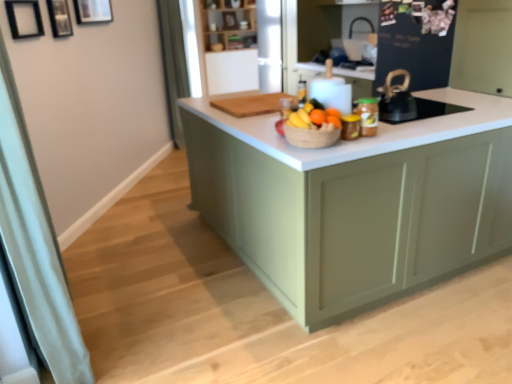
Question: Could you tell me if orange matte at center, which appears as the first orange when viewed from the right, is facing translucent glass bottle at center?

Choices:
 (A) no
 (B) yes

Answer: (A)

Question: From a real-world perspective, is orange matte at center, which appears as the first orange when viewed from the right, on translucent glass bottle at center?

Choices:
 (A) no
 (B) yes

Answer: (A)

Question: Is orange matte at center, marked as the 2th orange in a left-to-right arrangement, located outside translucent glass bottle at center?

Choices:
 (A) no
 (B) yes

Answer: (B)

Question: Is orange matte at center, which is counted as the first orange, starting from the back, at the left side of translucent glass bottle at center?

Choices:
 (A) yes
 (B) no

Answer: (B)

Question: From a real-world perspective, is orange matte at center, which appears as the first orange when viewed from the right, below translucent glass bottle at center?

Choices:
 (A) no
 (B) yes

Answer: (B)

Question: From the image's perspective, is orange matte at center, marked as the 2th orange in a left-to-right arrangement, below translucent glass bottle at center?

Choices:
 (A) no
 (B) yes

Answer: (B)

Question: Can we say wooden picture frame at upper left, arranged as the first picture frame when viewed from the back, lies outside orange matte at center, which appears as the first orange when viewed from the front?

Choices:
 (A) yes
 (B) no

Answer: (A)

Question: From a real-world perspective, does wooden picture frame at upper left, which appears as the 3th picture frame when viewed from the front, stand above orange matte at center, the 2th orange in the back-to-front sequence?

Choices:
 (A) yes
 (B) no

Answer: (A)

Question: Considering the relative sizes of wooden picture frame at upper left, which appears as the 3th picture frame when viewed from the front, and orange matte at center, the 2th orange in the back-to-front sequence, in the image provided, is wooden picture frame at upper left, which appears as the 3th picture frame when viewed from the front, thinner than orange matte at center, the 2th orange in the back-to-front sequence,?

Choices:
 (A) no
 (B) yes

Answer: (B)

Question: Does wooden picture frame at upper left, which appears as the 3th picture frame when viewed from the front, contain orange matte at center, the 2th orange from the right?

Choices:
 (A) yes
 (B) no

Answer: (B)

Question: Is wooden picture frame at upper left, which appears as the 3th picture frame when viewed from the front, at the left side of orange matte at center, which appears as the first orange when viewed from the front?

Choices:
 (A) yes
 (B) no

Answer: (A)

Question: Does wooden picture frame at upper left, arranged as the first picture frame when viewed from the back, have a lesser height compared to orange matte at center, which appears as the 1th orange when viewed from the left?

Choices:
 (A) no
 (B) yes

Answer: (A)

Question: Is orange matte at center smaller than white fabric curtain at left, which appears as the first curtain when viewed from the front?

Choices:
 (A) yes
 (B) no

Answer: (A)